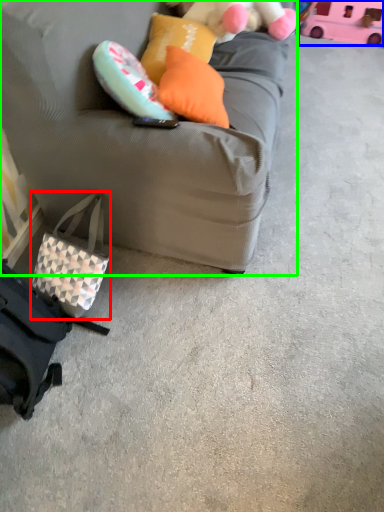
Question: Estimate the real-world distances between objects in this image. Which object is farther from pouch (highlighted by a red box), toy (highlighted by a blue box) or studio couch (highlighted by a green box)?

Choices:
 (A) toy
 (B) studio couch

Answer: (A)